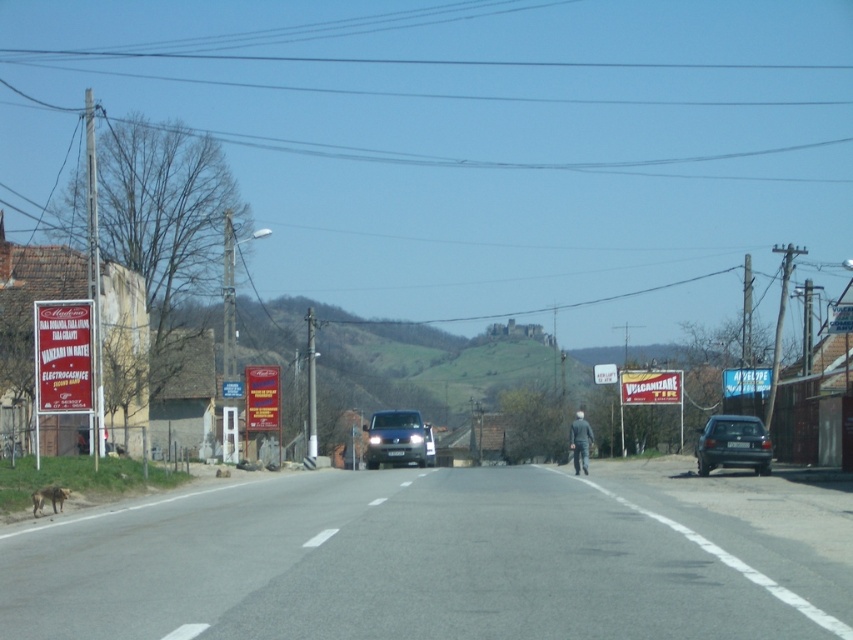
What is the color of the car located at the coordinates point (733, 444)?

The point (733, 444) corresponds to a dark gray metallic car at right.

You are a delivery driver who needs to park your vehicle, which is the same width as the satin black van at center. There is a narrow space between two parked cars that is only as wide as the brown fur dog at lower left. Will your vehicle fit in that space?

The satin black van at center is wider than the brown fur dog at lower left, so your vehicle, which is the same width as the satin black van at center, will not fit in the narrow space that is as wide as the brown fur dog at lower left.